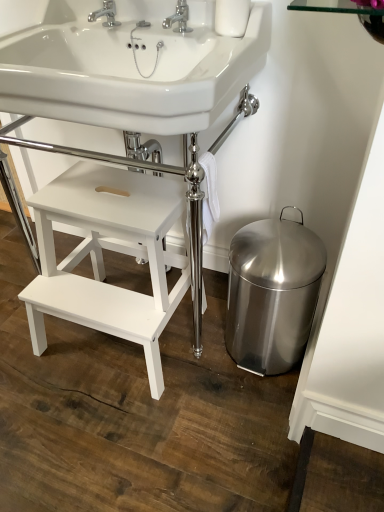
At what (x,y) coordinates should I click in order to perform the action: click on free space in front of white matte stool at lower left. Please return your answer as a coordinate pair (x, y). The height and width of the screenshot is (512, 384). Looking at the image, I should click on coord(121,438).